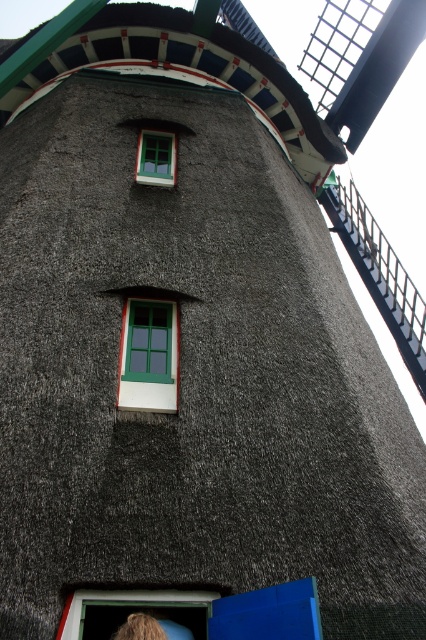
Is thatched straw roof at upper center positioned in front of green matte window at center?

No, thatched straw roof at upper center is further to the viewer.

Identify the location of thatched straw roof at upper center. (169, 68).

Where is `thatched straw roof at upper center`? The height and width of the screenshot is (640, 426). thatched straw roof at upper center is located at coordinates (169, 68).

This screenshot has width=426, height=640. What are the coordinates of `thatched straw roof at upper center` in the screenshot? It's located at (169, 68).

Is point (170, 381) closer to camera compared to point (166, 173)?

That is True.

Which is below, green matte window at center or green wooden window at upper center?

green matte window at center is lower down.

The image size is (426, 640). Describe the element at coordinates (149, 356) in the screenshot. I see `green matte window at center` at that location.

This screenshot has height=640, width=426. I want to click on green matte window at center, so click(149, 356).

Can you confirm if thatched straw roof at upper center is taller than green wooden window at upper center?

Yes.

Does thatched straw roof at upper center come in front of green wooden window at upper center?

No.

Locate an element on the screen. This screenshot has height=640, width=426. thatched straw roof at upper center is located at coordinates (169, 68).